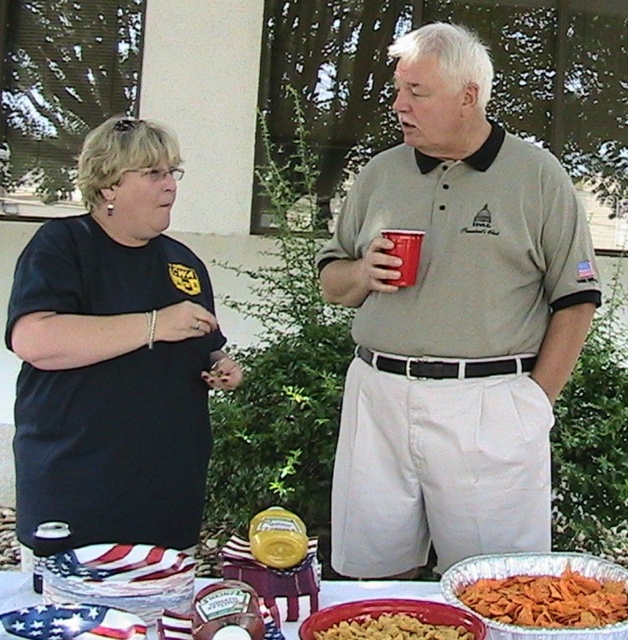
Can you confirm if gray cotton shirt at center is positioned below golden crispy chips at lower right?

Actually, gray cotton shirt at center is above golden crispy chips at lower right.

Is point (381, 326) closer to viewer compared to point (551, 593)?

No, it is behind (551, 593).

Which is in front, point (372, 472) or point (551, 595)?

Point (551, 595)

I want to click on gray cotton shirt at center, so click(x=452, y=324).

The image size is (628, 640). Describe the element at coordinates (452, 324) in the screenshot. I see `gray cotton shirt at center` at that location.

Measure the distance between gray cotton shirt at center and camera.

They are 7.12 feet apart.

Who is more distant from viewer, (440, 502) or (401, 285)?

Positioned behind is point (440, 502).

At what (x,y) coordinates should I click in order to perform the action: click on gray cotton shirt at center. Please return your answer as a coordinate pair (x, y). Looking at the image, I should click on (452, 324).

Based on the photo, is black matte shirt at center to the left of golden crispy chips at lower right from the viewer's perspective?

Correct, you'll find black matte shirt at center to the left of golden crispy chips at lower right.

Does point (146, 204) lie in front of point (502, 588)?

No, it is behind (502, 588).

Is point (143, 177) positioned in front of point (539, 624)?

No, it is not.

This screenshot has height=640, width=628. Identify the location of black matte shirt at center. (116, 355).